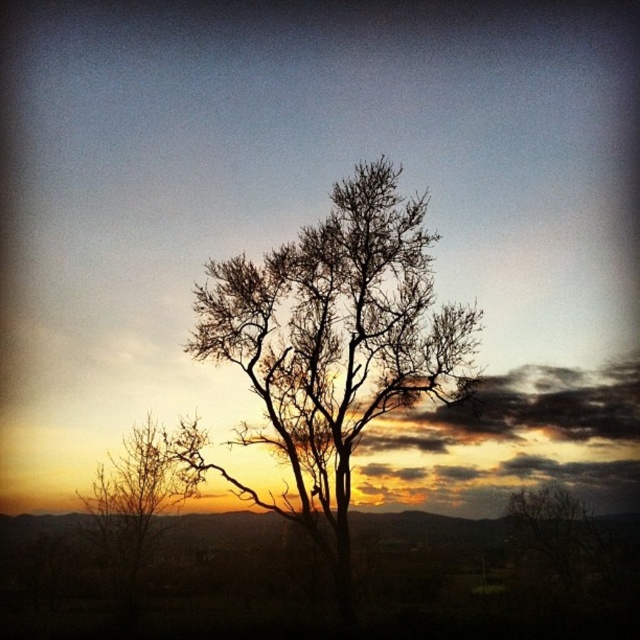
You are standing in front of the sunset scene and want to determine the relative positions of two points in the image. Given that you can see both point (x=346, y=433) and point (x=145, y=433), which point appears closer to you?

Point (x=346, y=433) is closer to the camera than point (x=145, y=433), so it appears closer to you.

You are an artist trying to sketch the sunset scene. You notice two sets of bare branches in the image. Which set of bare branches at center and bare branches at lower right would you need to draw larger in your sketch to accurately represent their size relationship?

The bare branches at center should be drawn larger than the bare branches at lower right because the description states that the bare branches at center is much taller than the bare branches at lower right.

You are an artist trying to sketch the sunset scene. You want to place the focal point of your drawing at the center of the image. Is the bare branches at center positioned at the exact center of the image?

The bare branches at center is located at point coordinates approximately (333, 342), which is slightly offset from the exact center. The exact center would be at coordinates (320, 320). Therefore, the bare branches at center is not positioned exactly at the center of the image.